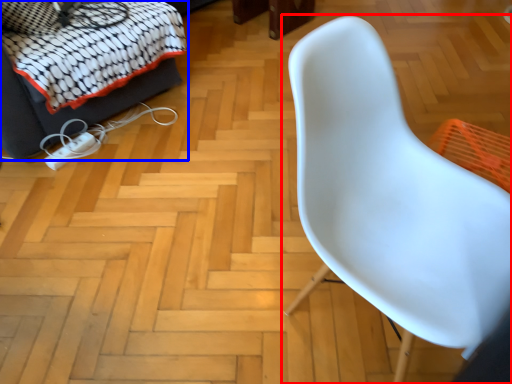
Question: Which point is closer to the camera, chair (highlighted by a red box) or furniture (highlighted by a blue box)?

Choices:
 (A) chair
 (B) furniture

Answer: (A)